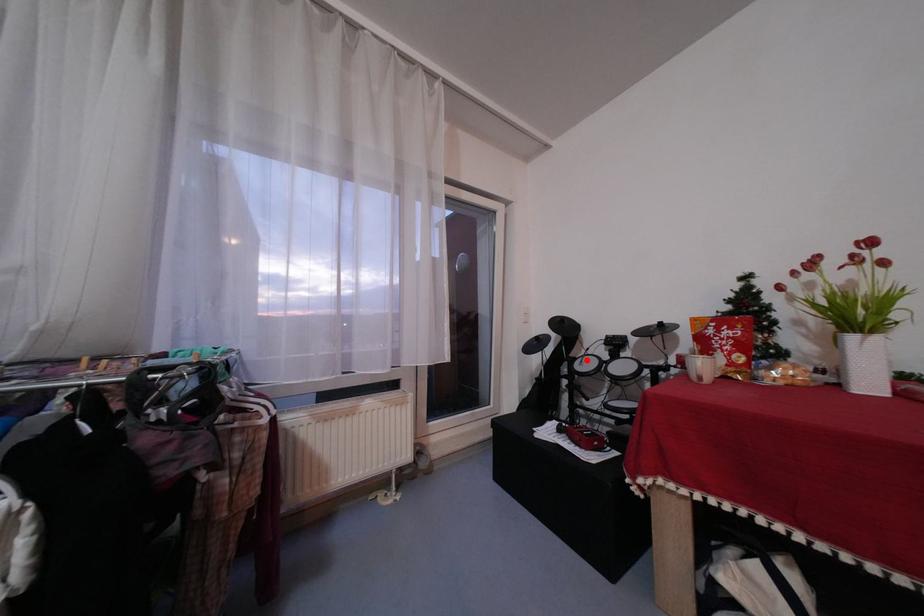
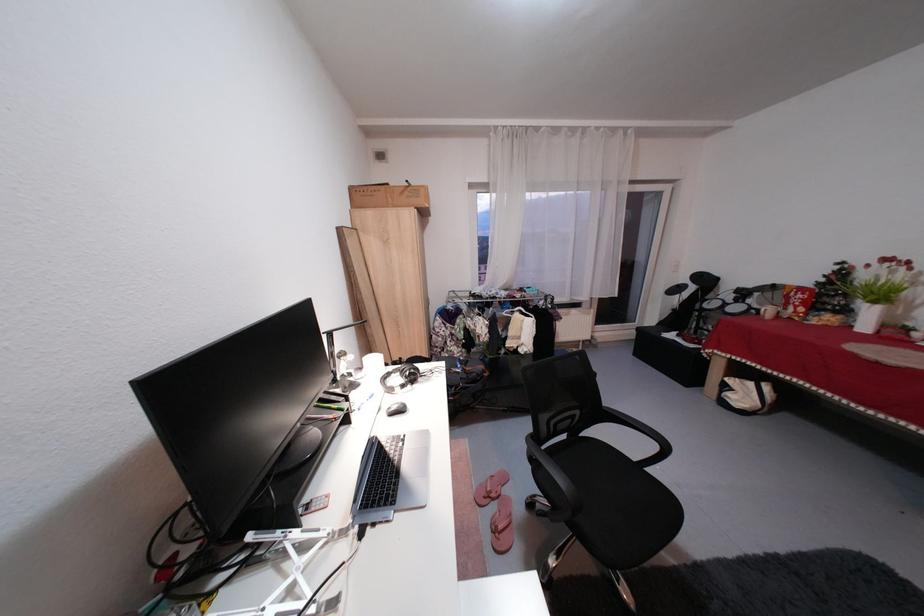
Question: I am providing you with two images of the same scene from different viewpoints. A red point is shown in image1. For the corresponding object point in image2, is it positioned nearer or farther from the camera?

Choices:
 (A) Nearer
 (B) Farther

Answer: (A)